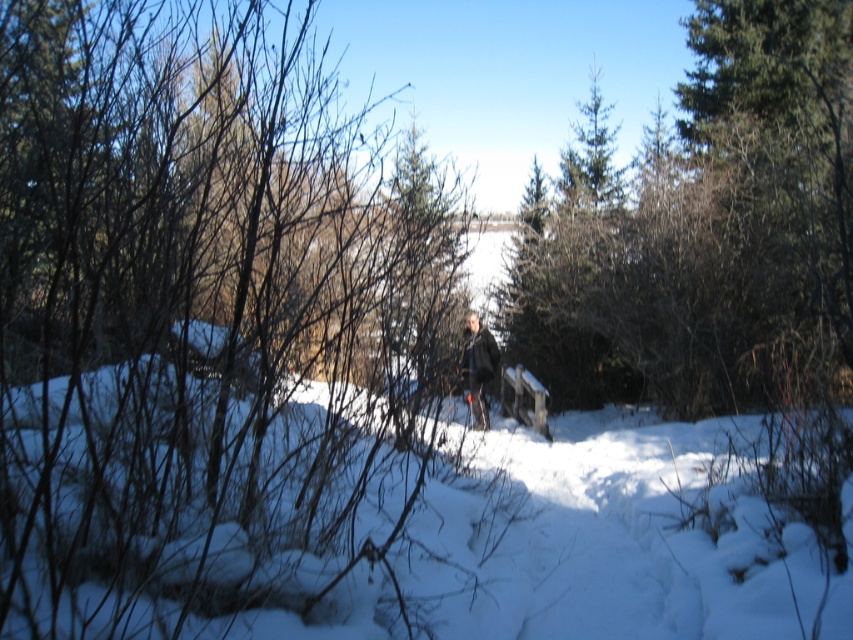
Question: Which point is closer to the camera?

Choices:
 (A) (611, 147)
 (B) (440, 417)
 (C) (495, 356)

Answer: (B)

Question: Can you confirm if green leafy tree at center is smaller than green textured pine tree at upper center?

Choices:
 (A) no
 (B) yes

Answer: (B)

Question: Observing the image, what is the correct spatial positioning of green leafy tree at center in reference to dark gray jacket at center?

Choices:
 (A) above
 (B) below

Answer: (A)

Question: Is green leafy tree at center to the right of dark gray jacket at center from the viewer's perspective?

Choices:
 (A) no
 (B) yes

Answer: (B)

Question: Which object appears farthest from the camera in this image?

Choices:
 (A) white fluffy snow at center
 (B) green leafy tree at center

Answer: (B)

Question: Which point is farther to the camera?

Choices:
 (A) white fluffy snow at center
 (B) green textured pine tree at upper center
 (C) dark gray jacket at center
 (D) green leafy tree at center

Answer: (B)